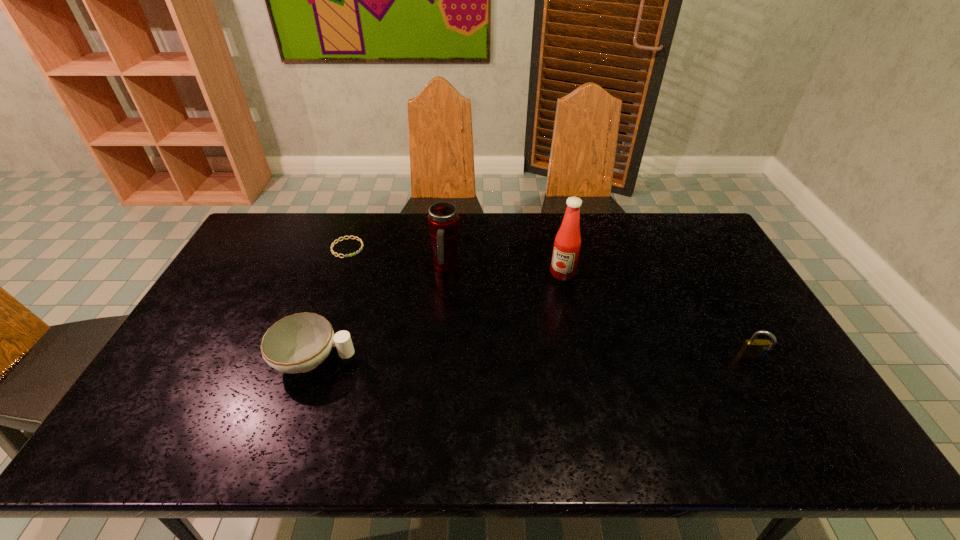
In order to click on chinaware in this screenshot , I will do `click(298, 343)`.

Identify the location of padlock. (754, 348).

This screenshot has height=540, width=960. Identify the location of the third object from right to left. (443, 220).

Where is `the second tallest object`? the second tallest object is located at coordinates [x=443, y=220].

Identify the location of the shortest object. (358, 239).

This screenshot has width=960, height=540. Identify the location of condiment. (567, 243).

The image size is (960, 540). Find the location of `the fourth object from left to right`. the fourth object from left to right is located at coordinates (567, 243).

Locate an element on the screen. vacant position located 0.320m on the side with the handle of the fourth tallest object is located at coordinates (475, 360).

Find the location of `free space located 0.060m on the side with the combination dials of the rightmost object`. free space located 0.060m on the side with the combination dials of the rightmost object is located at coordinates (767, 384).

This screenshot has height=540, width=960. I want to click on vacant space positioned on the side with the handle of the thermos bottle, so click(x=474, y=298).